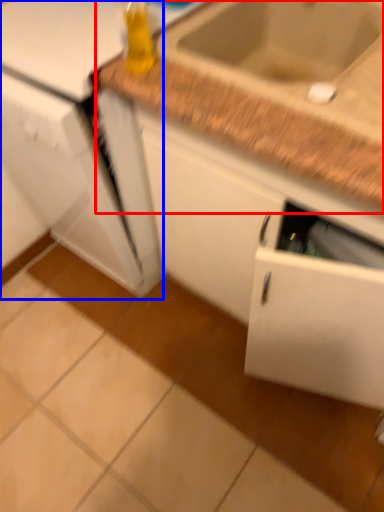
Question: Which object appears closest to the camera in this image, countertop (highlighted by a red box) or appliance (highlighted by a blue box)?

Choices:
 (A) countertop
 (B) appliance

Answer: (A)